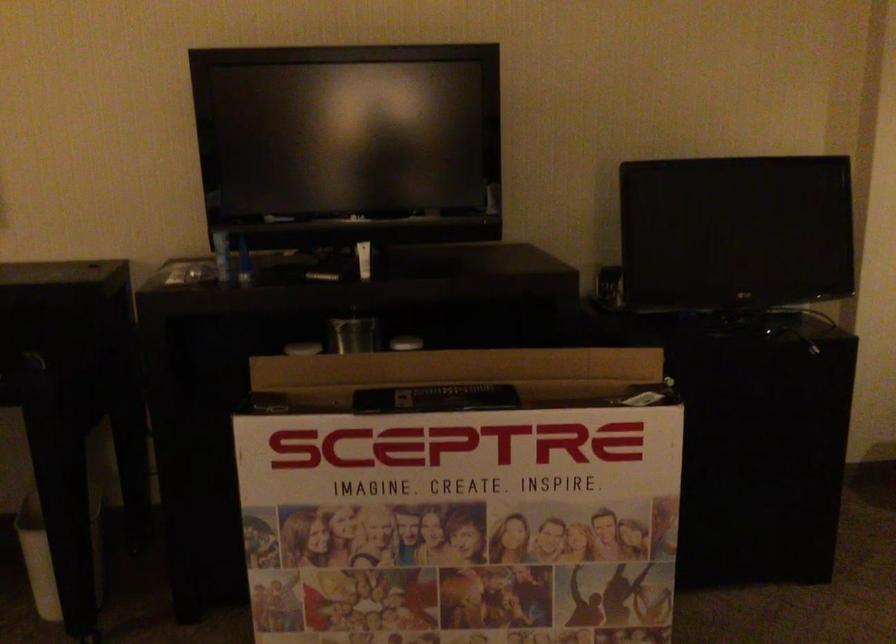
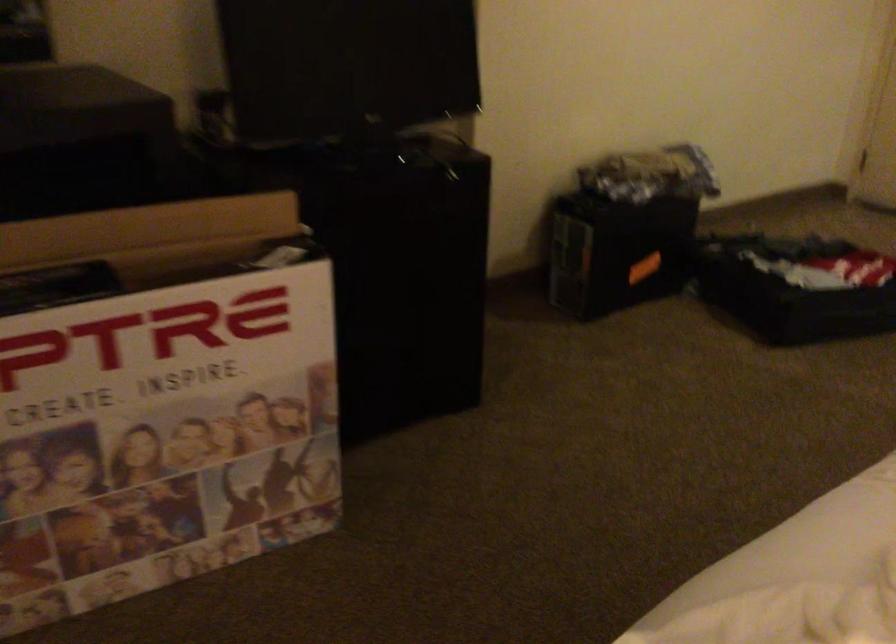
Question: The camera is either moving clockwise (left) or counter-clockwise (right) around the object. The first image is from the beginning of the video and the second image is from the end. Is the camera moving left or right when shooting the video?

Choices:
 (A) Left
 (B) Right

Answer: (A)